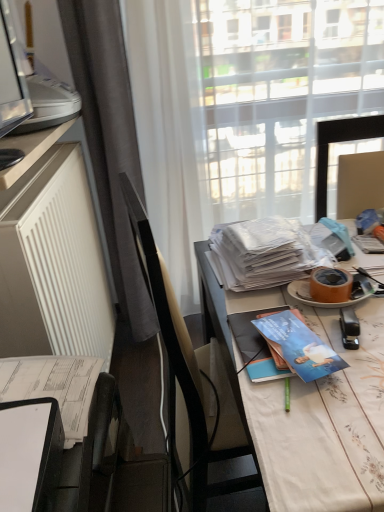
Identify the location of vacant space behind white paper journal at lower left. pos(52,380).